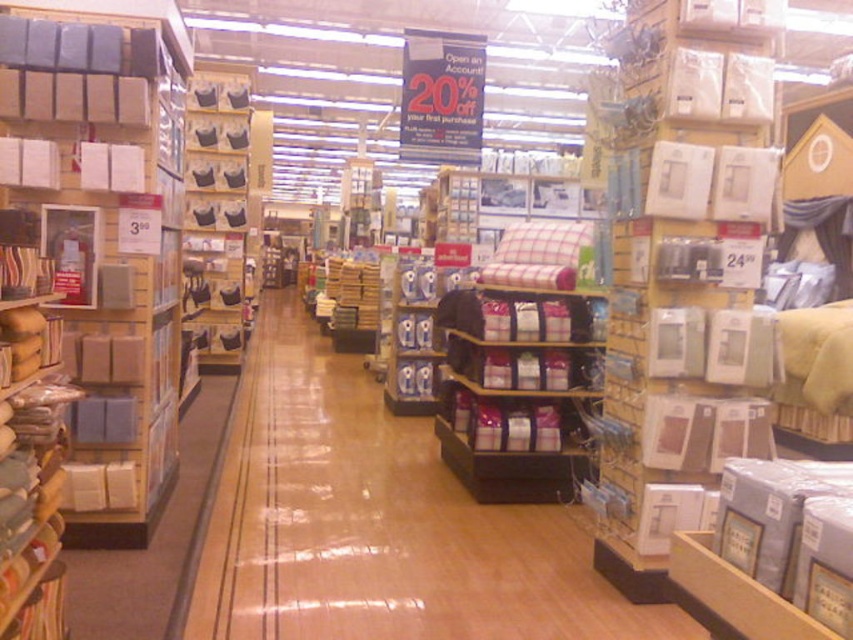
Question: Can you confirm if matte black pillow at center is bigger than black fabric bras at left?

Choices:
 (A) no
 (B) yes

Answer: (B)

Question: Which point appears closest to the camera in this image?

Choices:
 (A) (236, 305)
 (B) (614, 593)

Answer: (B)

Question: Considering the relative positions of matte black pillow at center and black fabric bras at left in the image provided, where is matte black pillow at center located with respect to black fabric bras at left?

Choices:
 (A) right
 (B) left

Answer: (A)

Question: Can you confirm if matte black pillow at center is positioned to the right of black fabric bras at left?

Choices:
 (A) yes
 (B) no

Answer: (A)

Question: Which point appears closest to the camera in this image?

Choices:
 (A) (234, 461)
 (B) (234, 211)

Answer: (A)